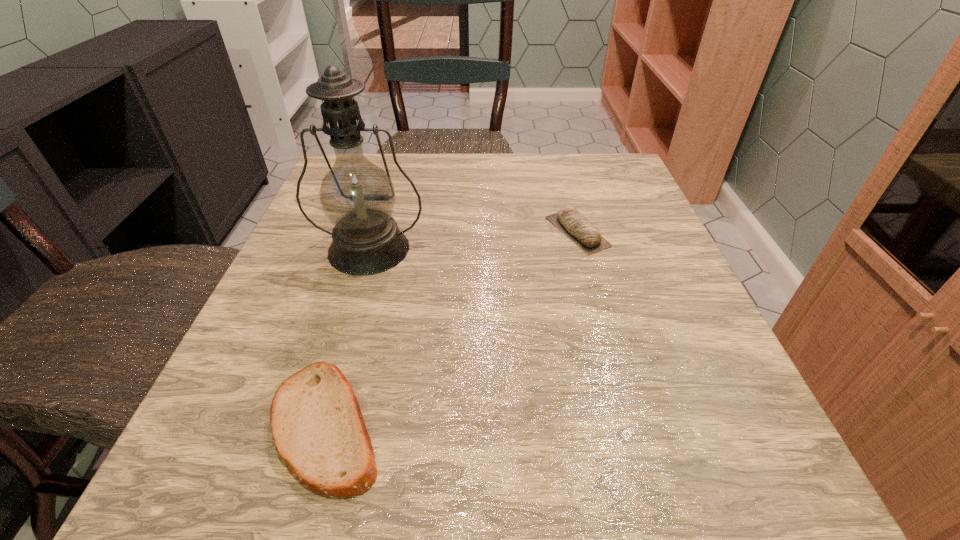
You are a GUI agent. You are given a task and a screenshot of the screen. Output one action in this format:
    pyautogui.click(x=<x>, y=<y>)
    Task: Click on the tallest object
    
    Given the screenshot: What is the action you would take?
    pyautogui.click(x=357, y=196)

What are the coordinates of `the rightmost object` in the screenshot? It's located at (575, 226).

Where is `the right pita bread`? This screenshot has width=960, height=540. the right pita bread is located at coordinates (575, 226).

At what (x,y) coordinates should I click in order to perform the action: click on the left pita bread. Please return your answer as a coordinate pair (x, y). The image size is (960, 540). Looking at the image, I should click on (317, 426).

This screenshot has width=960, height=540. I want to click on the nearer pita bread, so click(317, 426).

Find the location of `vacant space located 0.210m on the back of the tallest object`. vacant space located 0.210m on the back of the tallest object is located at coordinates (392, 174).

Image resolution: width=960 pixels, height=540 pixels. I want to click on blank area located 0.050m on the left of the right pita bread, so click(x=522, y=232).

The image size is (960, 540). Find the location of `vacant area situated on the back of the nearest object`. vacant area situated on the back of the nearest object is located at coordinates (374, 257).

Find the location of a particular element. The height and width of the screenshot is (540, 960). object situated at the near edge is located at coordinates (317, 426).

Where is `oil lamp positioned at the left edge`? The height and width of the screenshot is (540, 960). oil lamp positioned at the left edge is located at coordinates (357, 196).